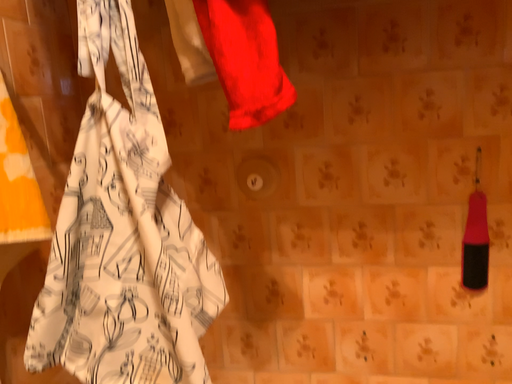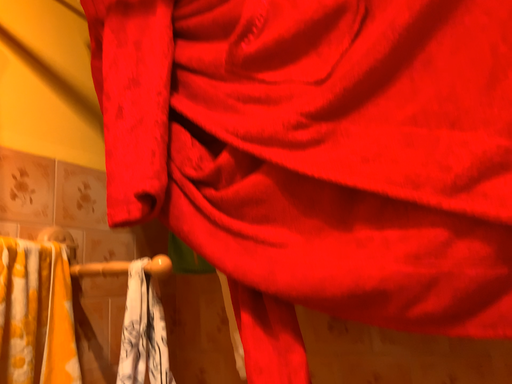
Question: How did the camera likely rotate when shooting the video?

Choices:
 (A) rotated upward
 (B) rotated downward

Answer: (A)